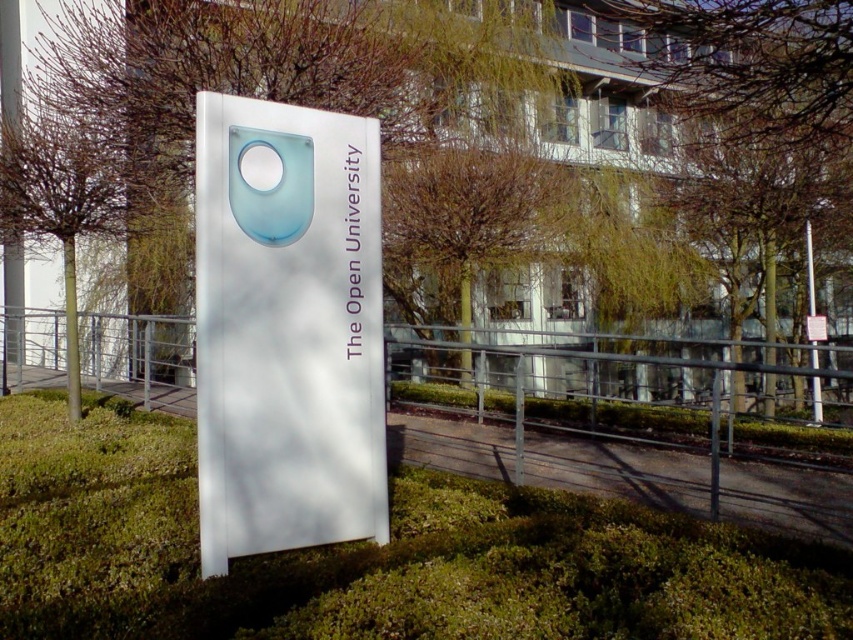
Question: In this image, where is green grass at center located relative to white glossy sign at center?

Choices:
 (A) above
 (B) below

Answer: (B)

Question: Which object is positioned closest to the white glossy sign at center?

Choices:
 (A) green grass at center
 (B) translucent blue circle at center

Answer: (B)

Question: Can you confirm if white glossy sign at center is positioned below translucent blue circle at center?

Choices:
 (A) no
 (B) yes

Answer: (B)

Question: Estimate the real-world distances between objects in this image. Which object is closer to the translucent blue circle at center?

Choices:
 (A) white glossy sign at center
 (B) green grass at center

Answer: (A)

Question: Among these objects, which one is nearest to the camera?

Choices:
 (A) white glossy sign at center
 (B) green grass at center

Answer: (B)

Question: Observing the image, what is the correct spatial positioning of green grass at center in reference to translucent blue circle at center?

Choices:
 (A) below
 (B) above

Answer: (A)